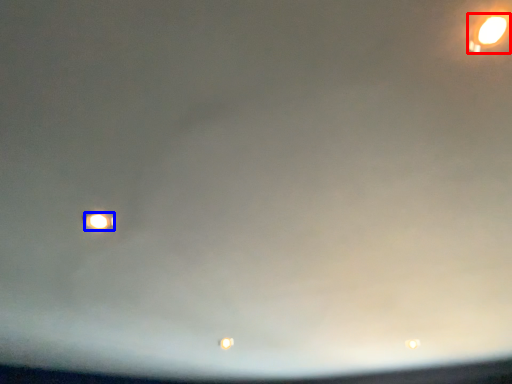
Question: Which object is further to the camera taking this photo, street light (highlighted by a red box) or street light (highlighted by a blue box)?

Choices:
 (A) street light
 (B) street light

Answer: (B)